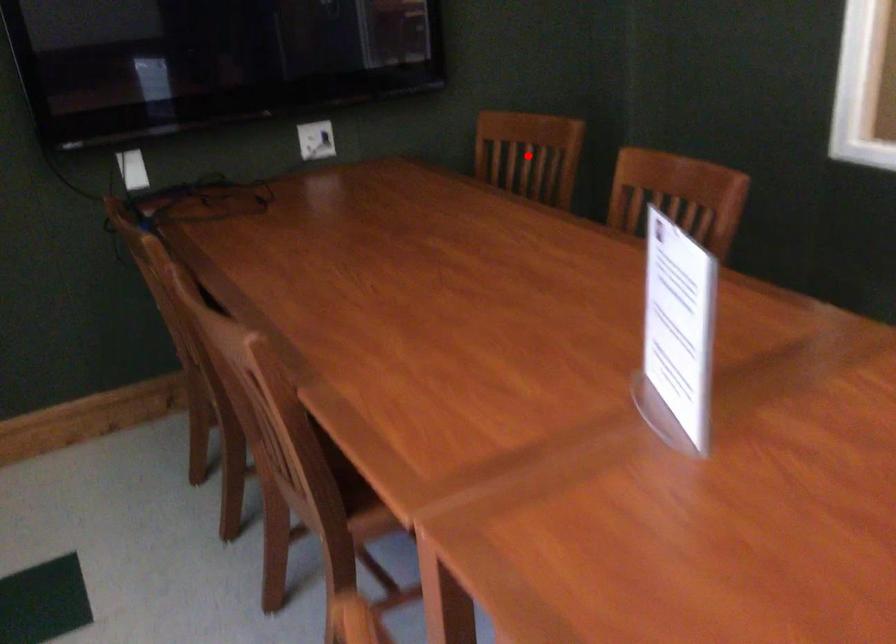
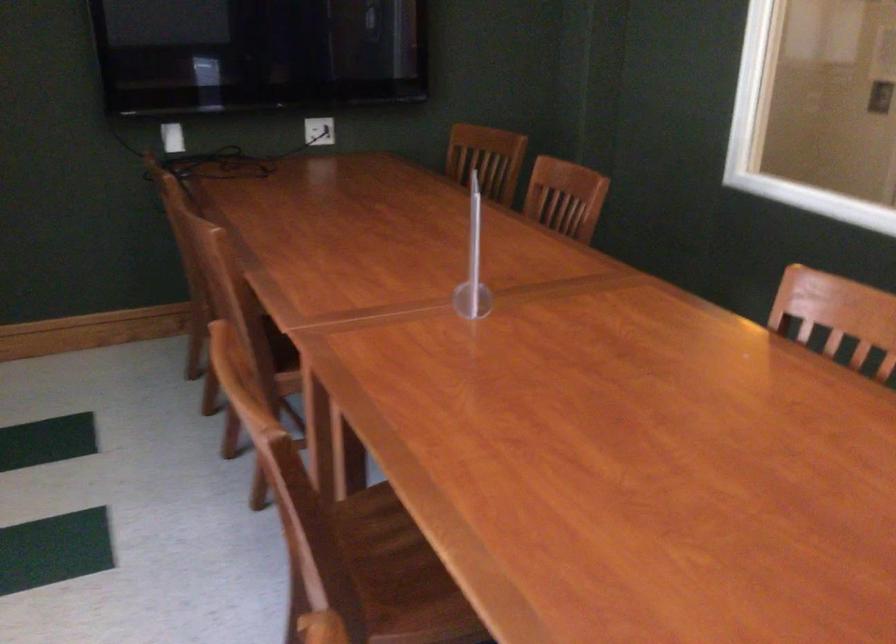
Question: I am providing you with two images of the same scene from different viewpoints. In image1, a red point is highlighted. Considering the same 3D point in image2, which of the following is correct?

Choices:
 (A) It is closer
 (B) It is farther

Answer: (B)